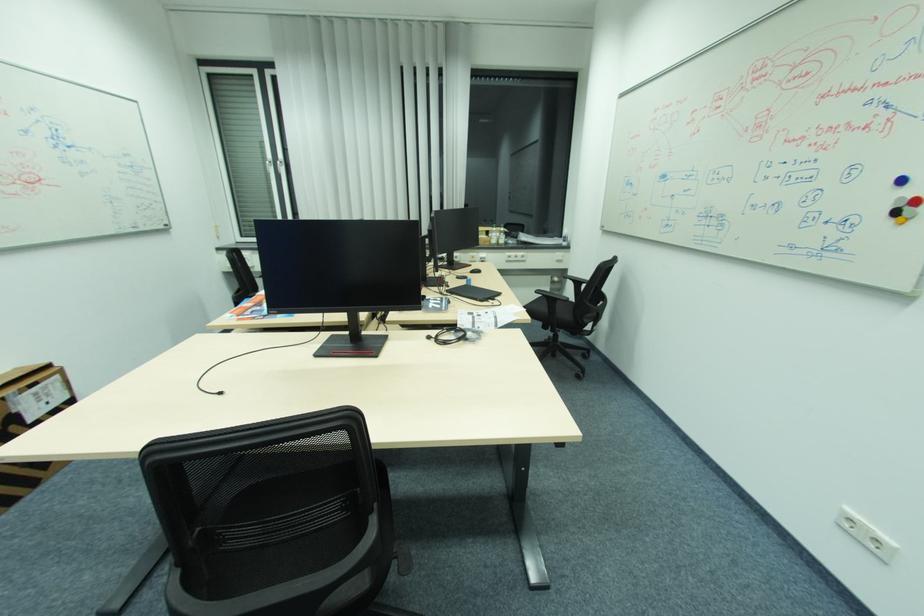
Which object does [901,220] point to?

This point indicates the yellow round magnet.